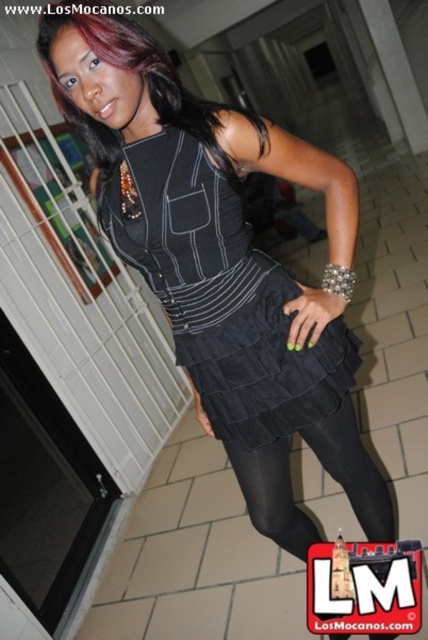
Is black suede dress at center behind black satin skirt at lower center?

No, it is in front of black satin skirt at lower center.

Which is more to the left, black suede dress at center or black satin skirt at lower center?

black suede dress at center is more to the left.

Which is in front, point (249, 420) or point (288, 445)?

Point (249, 420) is more forward.

Where is `black suede dress at center`? The width and height of the screenshot is (428, 640). black suede dress at center is located at coordinates (219, 292).

Is point (220, 436) behind point (80, 129)?

Yes.

Can you confirm if black suede dress at center is smaller than black shiny hair at center?

No.

At what (x,y) coordinates should I click in order to perform the action: click on black suede dress at center. Please return your answer as a coordinate pair (x, y). Image resolution: width=428 pixels, height=640 pixels. Looking at the image, I should click on (219, 292).

Who is shorter, black shiny hair at center or black satin skirt at lower center?

black shiny hair at center is shorter.

The height and width of the screenshot is (640, 428). What do you see at coordinates (140, 83) in the screenshot? I see `black shiny hair at center` at bounding box center [140, 83].

The image size is (428, 640). What do you see at coordinates (140, 83) in the screenshot? I see `black shiny hair at center` at bounding box center [140, 83].

At what (x,y) coordinates should I click in order to perform the action: click on black shiny hair at center. Please return your answer as a coordinate pair (x, y). The width and height of the screenshot is (428, 640). Looking at the image, I should click on (140, 83).